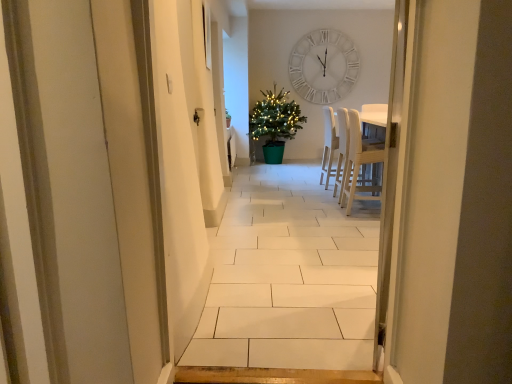
Question: Is light wood chair at center facing towards white wooden clock at upper center?

Choices:
 (A) no
 (B) yes

Answer: (A)

Question: From the image's perspective, is light wood chair at center on top of white wooden clock at upper center?

Choices:
 (A) yes
 (B) no

Answer: (B)

Question: From the image's perspective, is light wood chair at center beneath white wooden clock at upper center?

Choices:
 (A) no
 (B) yes

Answer: (B)

Question: Can you confirm if light wood chair at center is thinner than white wooden clock at upper center?

Choices:
 (A) no
 (B) yes

Answer: (A)

Question: Is light wood chair at center to the left of white wooden clock at upper center from the viewer's perspective?

Choices:
 (A) no
 (B) yes

Answer: (B)

Question: Is light wood chair at center facing away from white wooden clock at upper center?

Choices:
 (A) no
 (B) yes

Answer: (A)

Question: Would you say light wood chair at center is a long distance from green matte potted plant at center?

Choices:
 (A) no
 (B) yes

Answer: (B)

Question: Is light wood chair at center facing away from green matte potted plant at center?

Choices:
 (A) no
 (B) yes

Answer: (A)

Question: Does light wood chair at center have a larger size compared to green matte potted plant at center?

Choices:
 (A) yes
 (B) no

Answer: (B)

Question: From a real-world perspective, is light wood chair at center beneath green matte potted plant at center?

Choices:
 (A) yes
 (B) no

Answer: (A)

Question: Is light wood chair at center outside of green matte potted plant at center?

Choices:
 (A) no
 (B) yes

Answer: (B)

Question: Is light wood chair at center thinner than green matte potted plant at center?

Choices:
 (A) no
 (B) yes

Answer: (B)

Question: From the image's perspective, is light wood chair at center above white wood chairs at center?

Choices:
 (A) yes
 (B) no

Answer: (B)